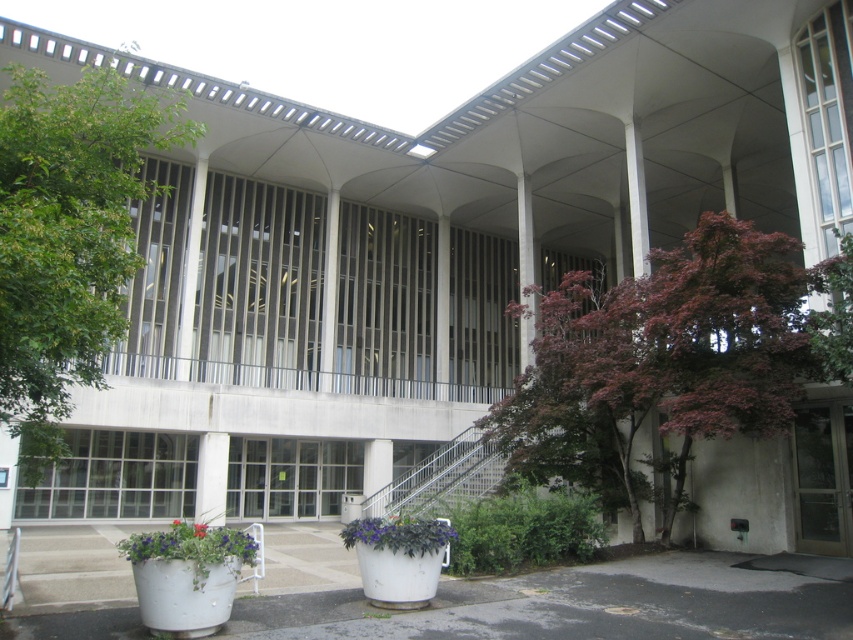
Does metallic gray staircase at center appear on the left side of red matte flower at center?

Incorrect, metallic gray staircase at center is not on the left side of red matte flower at center.

The height and width of the screenshot is (640, 853). Identify the location of metallic gray staircase at center. (442, 477).

Between green leafy tree at left and metallic gray staircase at center, which one has more height?

Standing taller between the two is green leafy tree at left.

Does point (18, 419) lie in front of point (448, 472)?

Yes, point (18, 419) is closer to viewer.

At what (x,y) coordinates should I click in order to perform the action: click on green leafy tree at left. Please return your answer as a coordinate pair (x, y). Looking at the image, I should click on (68, 237).

Is the position of purple leafy tree at center more distant than that of purple leafy tree at upper right?

That is True.

What do you see at coordinates (660, 364) in the screenshot? Image resolution: width=853 pixels, height=640 pixels. I see `purple leafy tree at center` at bounding box center [660, 364].

Which is behind, point (593, 480) or point (820, 356)?

The point (593, 480) is behind.

What are the coordinates of `purple leafy tree at center` in the screenshot? It's located at (660, 364).